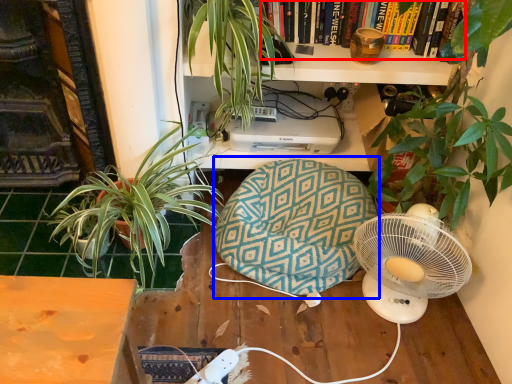
Question: Which object appears closest to the camera in this image, book (highlighted by a red box) or bean bag chair (highlighted by a blue box)?

Choices:
 (A) book
 (B) bean bag chair

Answer: (B)